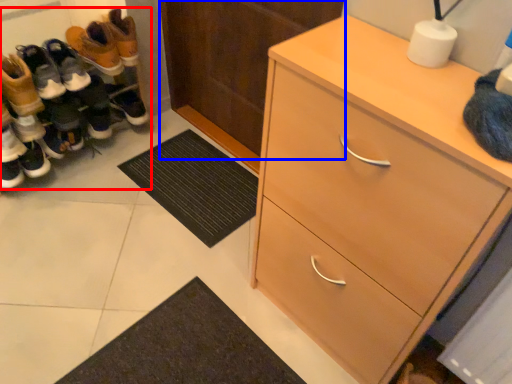
Question: Which object is further to the camera taking this photo, footwear (highlighted by a red box) or door (highlighted by a blue box)?

Choices:
 (A) footwear
 (B) door

Answer: (A)